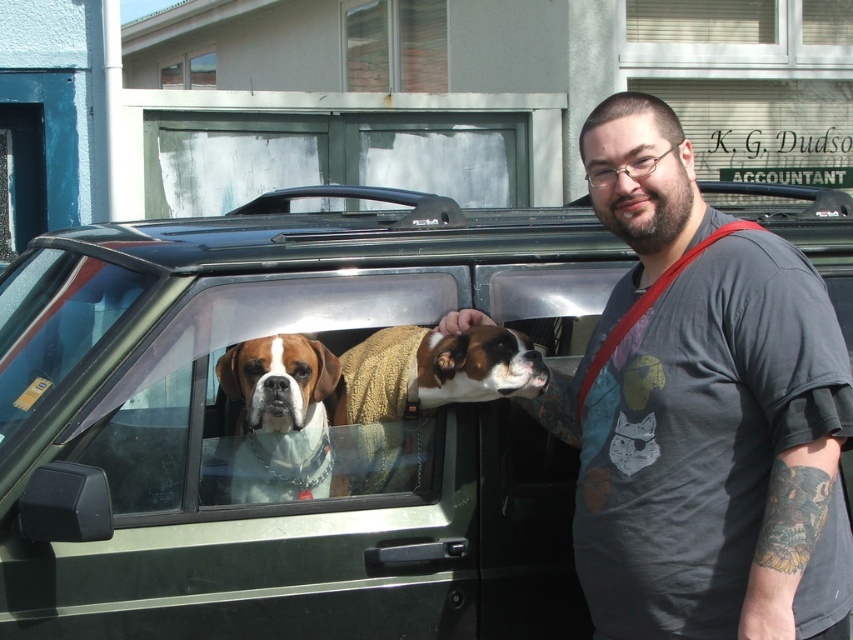
You are a delivery person who needs to park your van next to the green matte car at center. The van is 2 meters wide. Can you park your van without hitting the clear glass window at upper center?

The green matte car at center might be wider than clear glass window at upper center, so the van might not fit without hitting the window. Check the space carefully before parking.

You are a delivery person with a box that requires a 2.5 meter clearance to avoid damage. You need to place the box between yourself and the green matte car at center. Is the distance sufficient?

The distance between you and the green matte car at center is 2.05 meters, which is less than the required 2.5 meters clearance. Therefore, placing the box there may risk damaging the box.